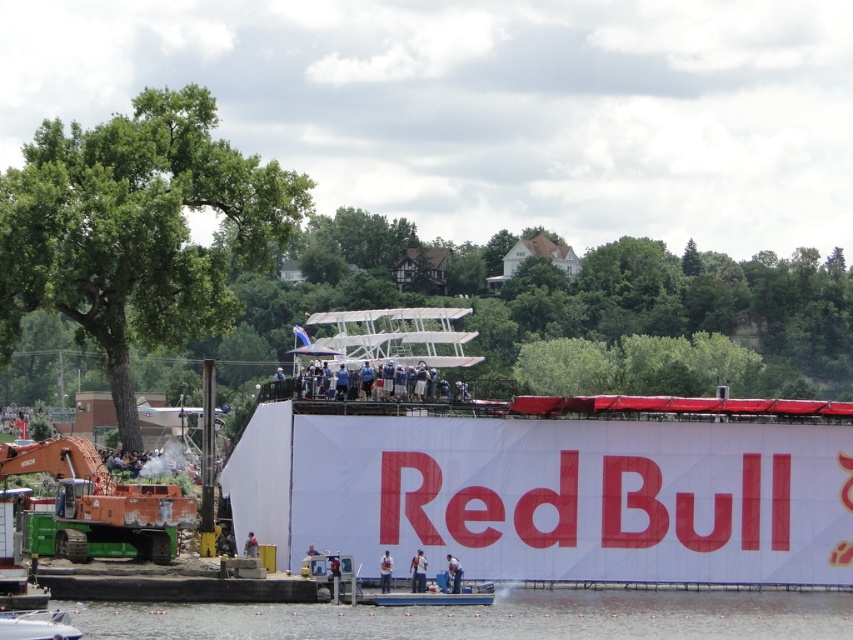
Question: Which object is farther from the camera taking this photo?

Choices:
 (A) clear water at lower center
 (B) white fabric person at lower center
 (C) blue fabric crowd at center
 (D) dark blue uniform at lower center

Answer: (C)

Question: Does white fabric person at lower center appear under blue fabric shirt at center?

Choices:
 (A) no
 (B) yes

Answer: (B)

Question: Can you confirm if dark blue uniform at lower center is smaller than white fabric person at lower center?

Choices:
 (A) no
 (B) yes

Answer: (B)

Question: Does white fabric person at lower center have a smaller size compared to blue fabric shirt at center?

Choices:
 (A) yes
 (B) no

Answer: (B)

Question: Which point is closer to the camera?

Choices:
 (A) (450, 570)
 (B) (254, 545)
 (C) (519, 634)

Answer: (C)

Question: Among these points, which one is farthest from the camera?

Choices:
 (A) (320, 388)
 (B) (387, 561)
 (C) (495, 632)
 (D) (448, 566)

Answer: (A)